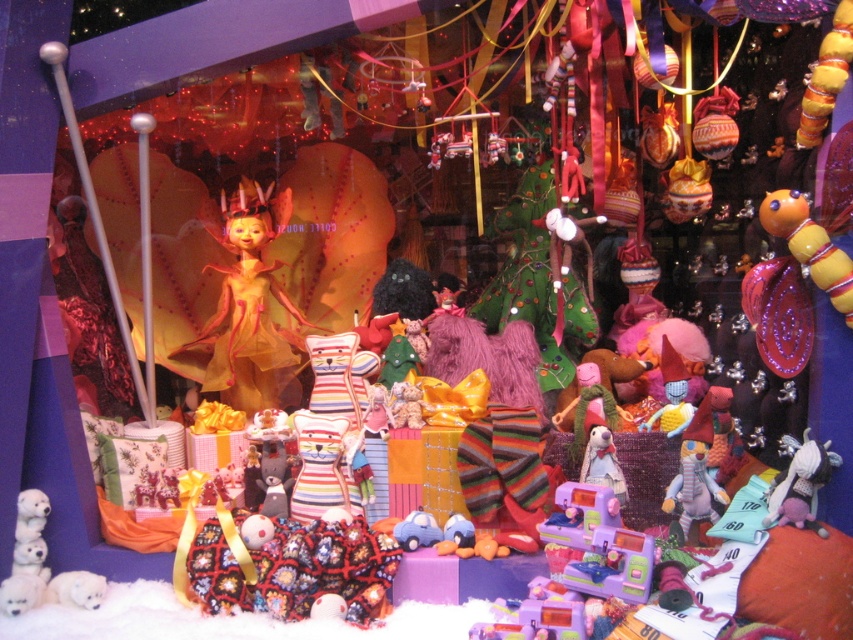
Is striped woolen hat at center below velvet plush toy at lower right?

Incorrect, striped woolen hat at center is not positioned below velvet plush toy at lower right.

Consider the image. Does striped woolen hat at center have a greater height compared to velvet plush toy at lower right?

Indeed, striped woolen hat at center has a greater height compared to velvet plush toy at lower right.

Image resolution: width=853 pixels, height=640 pixels. What are the coordinates of `striped woolen hat at center` in the screenshot? It's located at (694, 476).

Is shiny yellow caterpillar at center to the right of striped woolen hat at center from the viewer's perspective?

Yes, shiny yellow caterpillar at center is to the right of striped woolen hat at center.

Which is in front, point (805, 250) or point (712, 483)?

Point (805, 250)

Describe the element at coordinates (809, 244) in the screenshot. I see `shiny yellow caterpillar at center` at that location.

Image resolution: width=853 pixels, height=640 pixels. Find the location of `shiny yellow caterpillar at center`. shiny yellow caterpillar at center is located at coordinates point(809,244).

Between point (241, 252) and point (846, 321), which one is positioned behind?

Point (241, 252)

In the scene shown: Does matte orange fabric doll at center appear over shiny yellow caterpillar at center?

Incorrect, matte orange fabric doll at center is not positioned above shiny yellow caterpillar at center.

Measure the distance between point (281, 228) and camera.

Point (281, 228) and camera are 6.76 feet apart from each other.

Locate an element on the screen. matte orange fabric doll at center is located at coordinates (250, 305).